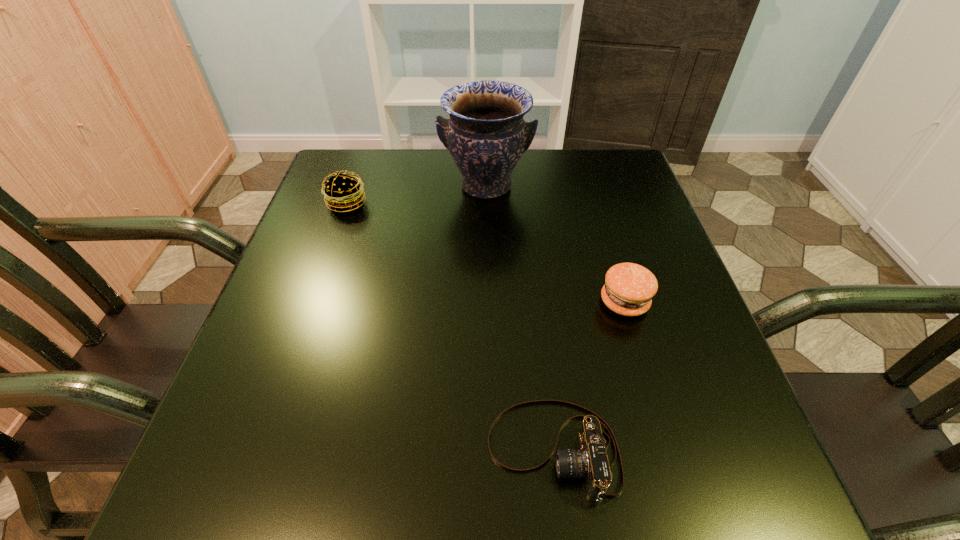
Where is `free space located on the front-facing side of the nearest object`? This screenshot has height=540, width=960. free space located on the front-facing side of the nearest object is located at coordinates (379, 450).

Identify the location of free space located 0.250m on the front-facing side of the nearest object. (318, 450).

At what (x,y) coordinates should I click in order to perform the action: click on vacant space situated 0.330m on the front-facing side of the nearest object. Please return your answer as a coordinate pair (x, y). Image resolution: width=960 pixels, height=540 pixels. Looking at the image, I should click on (264, 450).

This screenshot has height=540, width=960. Identify the location of pottery at the far edge. (486, 135).

Identify the location of patty positioned at the far edge. (343, 192).

What are the coordinates of `object present at the near edge` in the screenshot? It's located at (590, 461).

The image size is (960, 540). Find the location of `object present at the left edge`. object present at the left edge is located at coordinates (343, 192).

You are a GUI agent. You are given a task and a screenshot of the screen. Output one action in this format:
    pyautogui.click(x=<x>, y=<y>)
    Task: Click on the object located at the right edge
    The image size is (960, 540).
    Given the screenshot: What is the action you would take?
    pyautogui.click(x=629, y=288)

Find the location of a particular element. object that is at the far left corner is located at coordinates (343, 192).

Where is `vacant position at the far edge of the desktop`? vacant position at the far edge of the desktop is located at coordinates (551, 181).